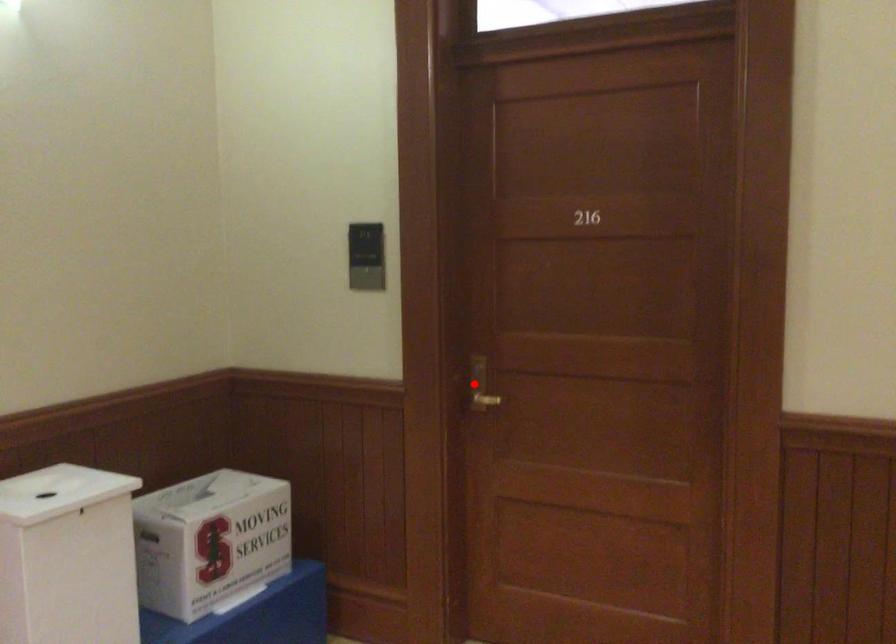
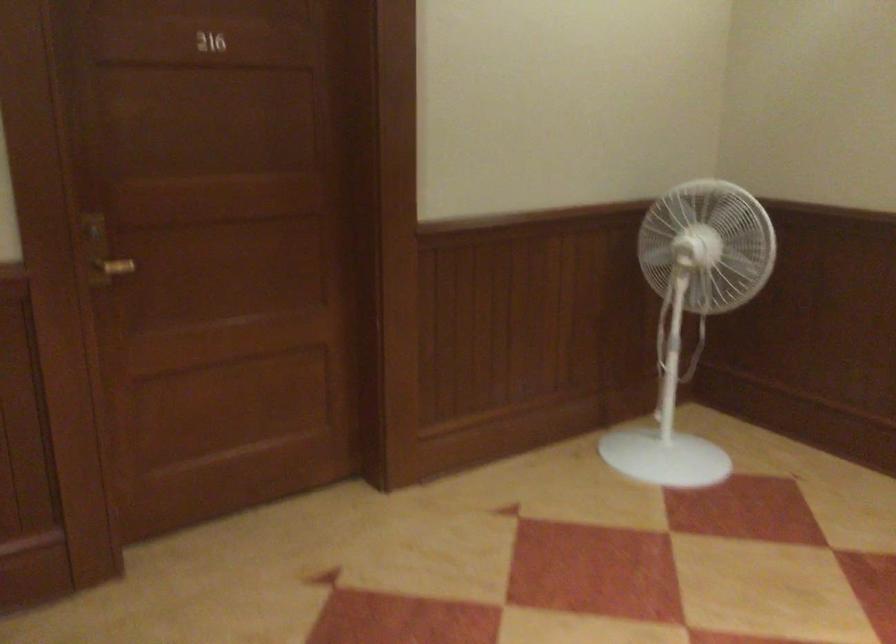
Find the pixel in the second image that matches the highlighted location in the first image.

(101, 252)